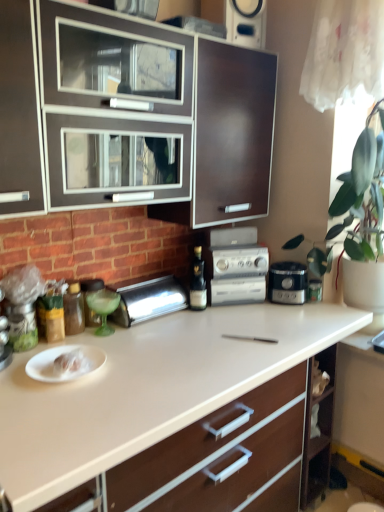
The image size is (384, 512). I want to click on free area behind white paper plate at lower left, so click(x=97, y=342).